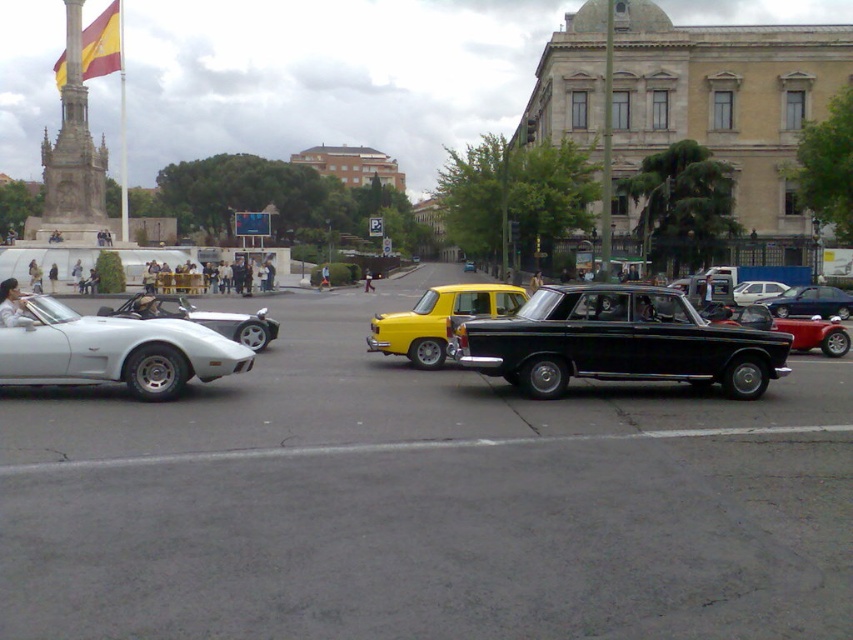
Question: Does shiny black car at center appear over white glossy sports car at left?

Choices:
 (A) no
 (B) yes

Answer: (B)

Question: Can you confirm if shiny black car at center is wider than white glossy sports car at left?

Choices:
 (A) no
 (B) yes

Answer: (B)

Question: Based on their relative distances, which object is farther from the shiny silver sports car at left?

Choices:
 (A) metallic silver sedan at center
 (B) yellow matte taxi at center
 (C) shiny black car at center

Answer: (A)

Question: Observing the image, what is the correct spatial positioning of yellow matte taxi at center in reference to metallic silver sedan at center?

Choices:
 (A) below
 (B) above

Answer: (A)

Question: Which point is closer to the camera?

Choices:
 (A) white glossy sports car at left
 (B) shiny silver sports car at left

Answer: (A)

Question: Which object appears closest to the camera in this image?

Choices:
 (A) white glossy sports car at left
 (B) metallic silver sedan at center
 (C) shiny silver sports car at left
 (D) yellow matte taxi at center

Answer: (A)